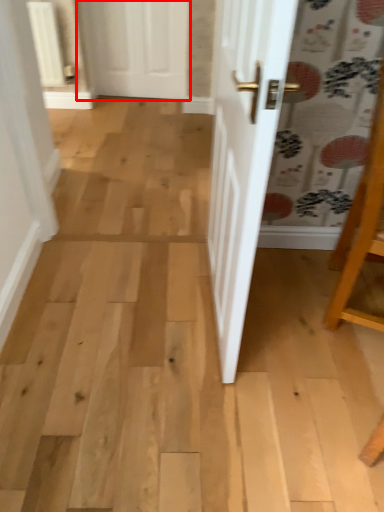
Question: Where is door (annotated by the red box) located in relation to furniture in the image?

Choices:
 (A) right
 (B) left

Answer: (B)